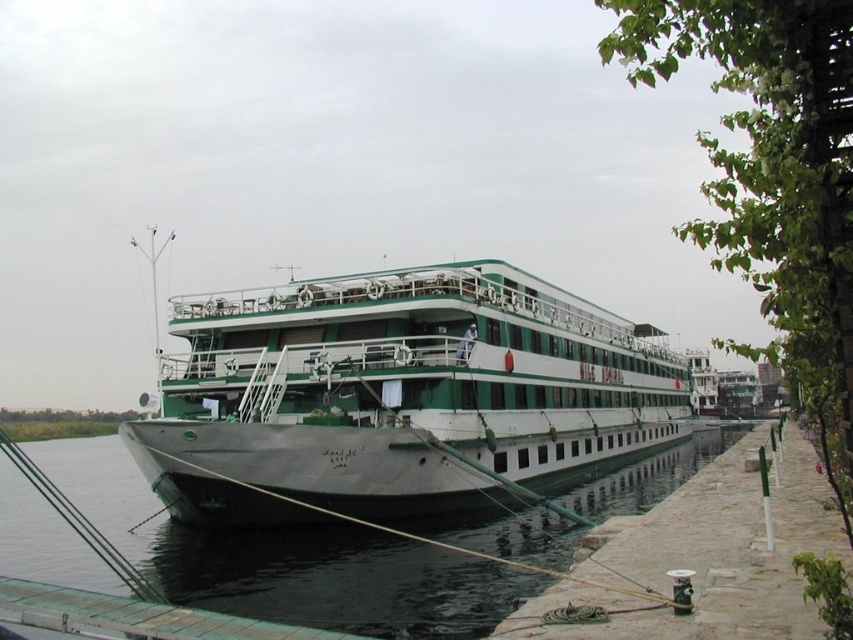
Consider the image. Which of these two, green matte ship at center or black rubber water at lower left, stands taller?

Standing taller between the two is green matte ship at center.

Is green matte ship at center to the right of black rubber water at lower left from the viewer's perspective?

Correct, you'll find green matte ship at center to the right of black rubber water at lower left.

Who is more distant from viewer, [242,440] or [103,525]?

Point [103,525]

I want to click on green matte ship at center, so (x=401, y=397).